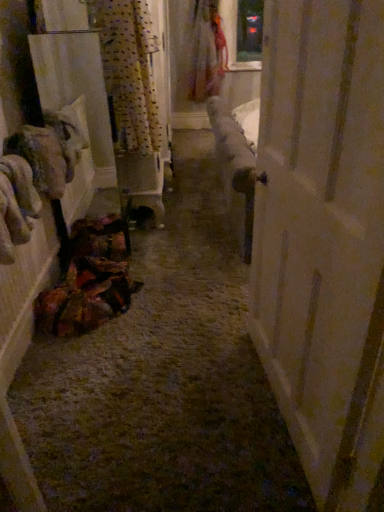
Question: Is white wood door at right at the right side of floral fabric dress at upper center?

Choices:
 (A) yes
 (B) no

Answer: (A)

Question: Considering the relative sizes of white wood door at right and floral fabric dress at upper center in the image provided, is white wood door at right bigger than floral fabric dress at upper center?

Choices:
 (A) no
 (B) yes

Answer: (A)

Question: Is white wood door at right positioned in front of floral fabric dress at upper center?

Choices:
 (A) yes
 (B) no

Answer: (A)

Question: Does white wood door at right have a greater width compared to floral fabric dress at upper center?

Choices:
 (A) yes
 (B) no

Answer: (B)

Question: Can you confirm if white wood door at right is thinner than floral fabric dress at upper center?

Choices:
 (A) no
 (B) yes

Answer: (B)

Question: Is patterned fabric curtain at upper left in front of or behind floral fabric dress at upper center in the image?

Choices:
 (A) behind
 (B) front

Answer: (B)

Question: From the image's perspective, relative to floral fabric dress at upper center, is patterned fabric curtain at upper left above or below?

Choices:
 (A) above
 (B) below

Answer: (B)

Question: Is patterned fabric curtain at upper left to the left or to the right of floral fabric dress at upper center in the image?

Choices:
 (A) left
 (B) right

Answer: (A)

Question: From a real-world perspective, relative to floral fabric dress at upper center, is patterned fabric curtain at upper left vertically above or below?

Choices:
 (A) below
 (B) above

Answer: (B)

Question: Based on their positions, is white wood door at right located to the left or right of patterned fabric curtain at upper left?

Choices:
 (A) left
 (B) right

Answer: (B)

Question: From the image's perspective, is white wood door at right above or below patterned fabric curtain at upper left?

Choices:
 (A) below
 (B) above

Answer: (A)

Question: Is white wood door at right spatially inside patterned fabric curtain at upper left, or outside of it?

Choices:
 (A) outside
 (B) inside

Answer: (A)

Question: Based on their sizes in the image, would you say white wood door at right is bigger or smaller than patterned fabric curtain at upper left?

Choices:
 (A) big
 (B) small

Answer: (A)

Question: Looking at their shapes, would you say white wood door at right is wider or thinner than floral fabric dress at upper center?

Choices:
 (A) thin
 (B) wide

Answer: (A)

Question: Is white wood door at right taller or shorter than floral fabric dress at upper center?

Choices:
 (A) short
 (B) tall

Answer: (B)